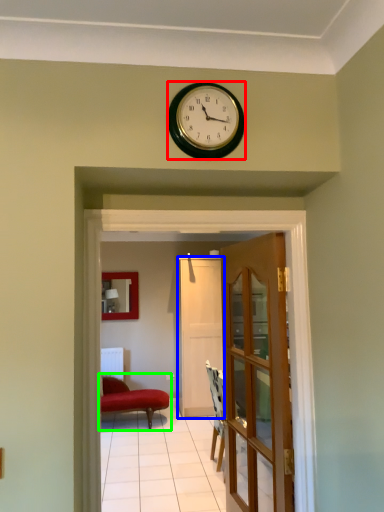
Question: Which object is the farthest from wall clock (highlighted by a red box)? Choose among these: door (highlighted by a blue box) or studio couch (highlighted by a green box).

Choices:
 (A) door
 (B) studio couch

Answer: (A)